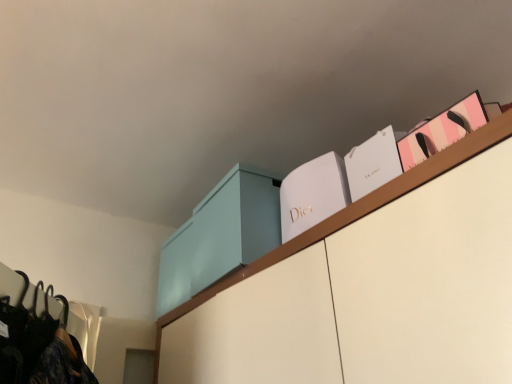
Question: Is white paper bag at upper right, marked as the 2th book in a right-to-left arrangement, at the right side of white matte dior box at upper center, marked as the 3th book in a right-to-left arrangement?

Choices:
 (A) yes
 (B) no

Answer: (A)

Question: From the image's perspective, is white paper bag at upper right, marked as the 2th book in a right-to-left arrangement, on white matte dior box at upper center, which appears as the first book when viewed from the left?

Choices:
 (A) no
 (B) yes

Answer: (B)

Question: Is white paper bag at upper right, marked as the 2th book in a right-to-left arrangement, directly adjacent to white matte dior box at upper center, which appears as the first book when viewed from the left?

Choices:
 (A) yes
 (B) no

Answer: (B)

Question: Is white paper bag at upper right, the 2th book in the left-to-right sequence, at the left side of white matte dior box at upper center, which appears as the first book when viewed from the left?

Choices:
 (A) yes
 (B) no

Answer: (B)

Question: Is white matte dior box at upper center, which appears as the first book when viewed from the left, completely or partially inside white paper bag at upper right, the 2th book in the left-to-right sequence?

Choices:
 (A) no
 (B) yes

Answer: (A)

Question: Is the position of white paper bag at upper right, the 2th book in the left-to-right sequence, less distant than that of white matte dior box at upper center, which appears as the first book when viewed from the left?

Choices:
 (A) yes
 (B) no

Answer: (A)

Question: Can you confirm if light blue matte cabinet at upper center is wider than pink paper bag at upper right, the 1th book positioned from the right?

Choices:
 (A) yes
 (B) no

Answer: (A)

Question: Does light blue matte cabinet at upper center have a smaller size compared to pink paper bag at upper right, the 1th book positioned from the right?

Choices:
 (A) no
 (B) yes

Answer: (A)

Question: Is light blue matte cabinet at upper center in contact with pink paper bag at upper right, the 1th book positioned from the right?

Choices:
 (A) no
 (B) yes

Answer: (A)

Question: Does light blue matte cabinet at upper center have a larger size compared to pink paper bag at upper right, the 3th book from the left?

Choices:
 (A) no
 (B) yes

Answer: (B)

Question: Considering the relative positions of light blue matte cabinet at upper center and pink paper bag at upper right, the 3th book from the left, in the image provided, is light blue matte cabinet at upper center to the right of pink paper bag at upper right, the 3th book from the left, from the viewer's perspective?

Choices:
 (A) yes
 (B) no

Answer: (B)

Question: From a real-world perspective, does light blue matte cabinet at upper center stand above pink paper bag at upper right, the 3th book from the left?

Choices:
 (A) no
 (B) yes

Answer: (B)

Question: From the image's perspective, is white paper bag at upper right, marked as the 2th book in a right-to-left arrangement, above light blue matte cabinet at upper center?

Choices:
 (A) yes
 (B) no

Answer: (A)